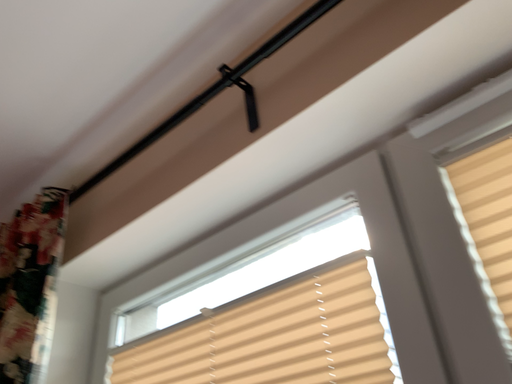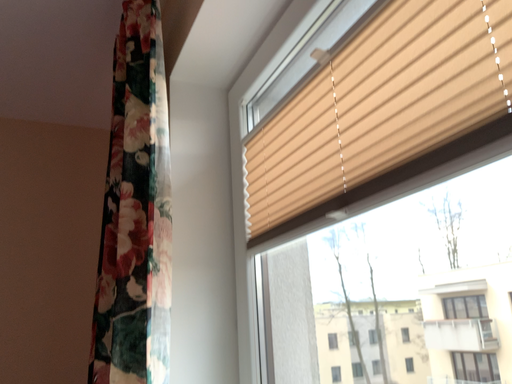
Question: How did the camera likely rotate when shooting the video?

Choices:
 (A) rotated right
 (B) rotated left

Answer: (B)